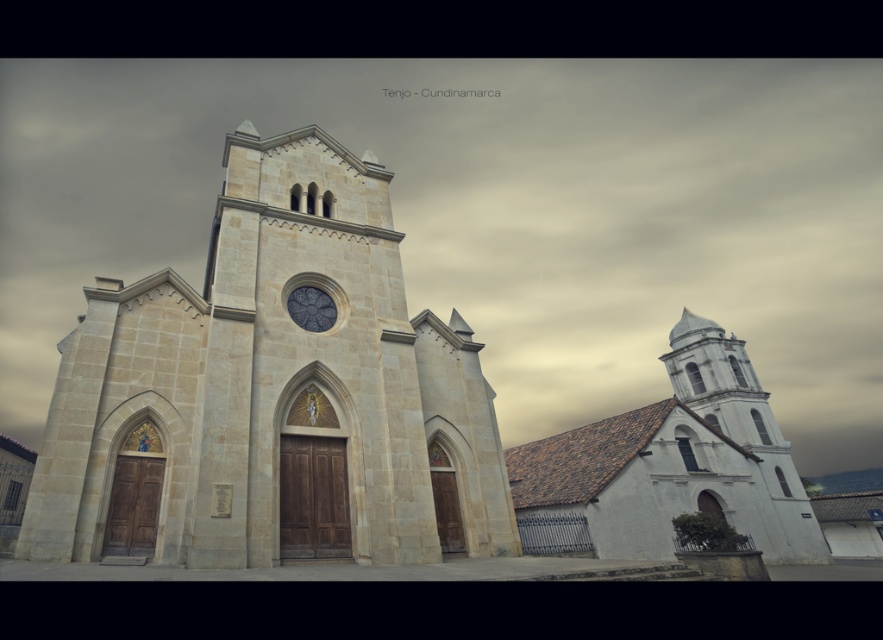
Question: Does light beige stone church tower at center appear under stained glass window at center?

Choices:
 (A) no
 (B) yes

Answer: (B)

Question: Does light beige stone church tower at center appear on the left side of stained glass window at center?

Choices:
 (A) yes
 (B) no

Answer: (A)

Question: Which object is farther from the camera taking this photo?

Choices:
 (A) light beige stone church tower at center
 (B) stained glass window at center

Answer: (B)

Question: Does light beige stone church tower at center have a smaller size compared to stained glass window at center?

Choices:
 (A) no
 (B) yes

Answer: (A)

Question: Among these objects, which one is farthest from the camera?

Choices:
 (A) stained glass window at center
 (B) light beige stone church tower at center

Answer: (A)

Question: Which object is closer to the camera taking this photo?

Choices:
 (A) stained glass window at center
 (B) light beige stone church tower at center

Answer: (B)